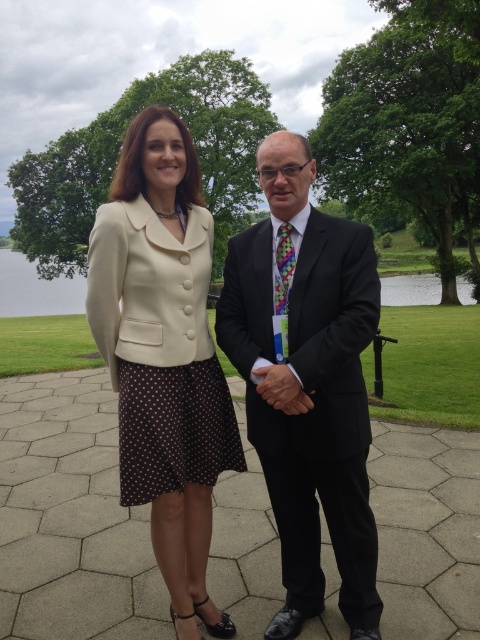
Question: Is matte black suit at center below cream matte blazer at center?

Choices:
 (A) no
 (B) yes

Answer: (A)

Question: Which object is the closest to the cream matte blazer at center?

Choices:
 (A) matte black suit at center
 (B) smooth leather hand at center

Answer: (B)

Question: Estimate the real-world distances between objects in this image. Which object is closer to the matte black suit at center?

Choices:
 (A) cream matte blazer at center
 (B) smooth leather hand at center

Answer: (B)

Question: From the image, what is the correct spatial relationship of matte black suit at center in relation to cream matte blazer at center?

Choices:
 (A) left
 (B) right

Answer: (B)

Question: Can you confirm if matte black suit at center is positioned to the right of smooth leather hand at center?

Choices:
 (A) no
 (B) yes

Answer: (B)

Question: Among these points, which one is nearest to the camera?

Choices:
 (A) (276, 401)
 (B) (288, 506)

Answer: (A)